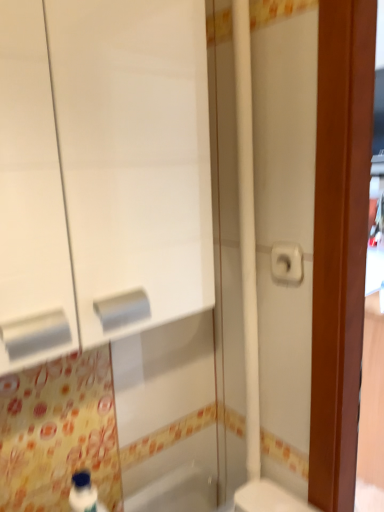
Question: From a real-world perspective, is white glossy toilet at lower right positioned over white matte cabinet at left based on gravity?

Choices:
 (A) yes
 (B) no

Answer: (B)

Question: Is white glossy toilet at lower right directly adjacent to white matte cabinet at left?

Choices:
 (A) no
 (B) yes

Answer: (A)

Question: From the image's perspective, is white glossy toilet at lower right located beneath white matte cabinet at left?

Choices:
 (A) yes
 (B) no

Answer: (A)

Question: Is white glossy toilet at lower right bigger than white matte cabinet at left?

Choices:
 (A) yes
 (B) no

Answer: (B)

Question: Is white glossy toilet at lower right at the left side of white matte cabinet at left?

Choices:
 (A) no
 (B) yes

Answer: (A)

Question: Considering the relative sizes of white glossy toilet at lower right and white matte cabinet at left in the image provided, is white glossy toilet at lower right smaller than white matte cabinet at left?

Choices:
 (A) yes
 (B) no

Answer: (A)

Question: Can you confirm if white glossy bathtub at lower center is taller than white glossy toilet at lower right?

Choices:
 (A) no
 (B) yes

Answer: (A)

Question: Is white glossy bathtub at lower center further to camera compared to white glossy toilet at lower right?

Choices:
 (A) yes
 (B) no

Answer: (B)

Question: Is white glossy bathtub at lower center positioned far away from white glossy toilet at lower right?

Choices:
 (A) no
 (B) yes

Answer: (A)

Question: Is white glossy bathtub at lower center oriented away from white glossy toilet at lower right?

Choices:
 (A) yes
 (B) no

Answer: (B)

Question: From the image's perspective, is white glossy bathtub at lower center below white glossy toilet at lower right?

Choices:
 (A) yes
 (B) no

Answer: (B)

Question: Does white glossy bathtub at lower center have a smaller size compared to white glossy toilet at lower right?

Choices:
 (A) yes
 (B) no

Answer: (A)

Question: Is white matte cabinet at left further to the viewer compared to white matte toilet paper at right?

Choices:
 (A) no
 (B) yes

Answer: (A)